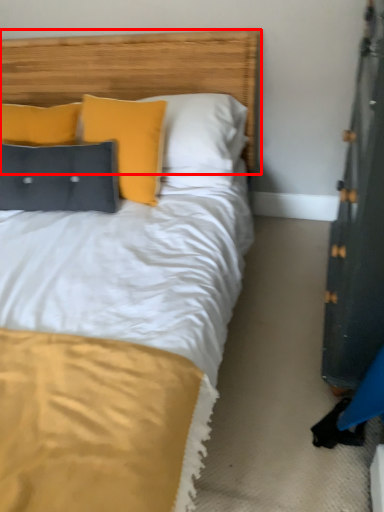
Question: From the image's perspective, what is the correct spatial relationship of headboard (annotated by the red box) in relation to pillow?

Choices:
 (A) above
 (B) below

Answer: (A)